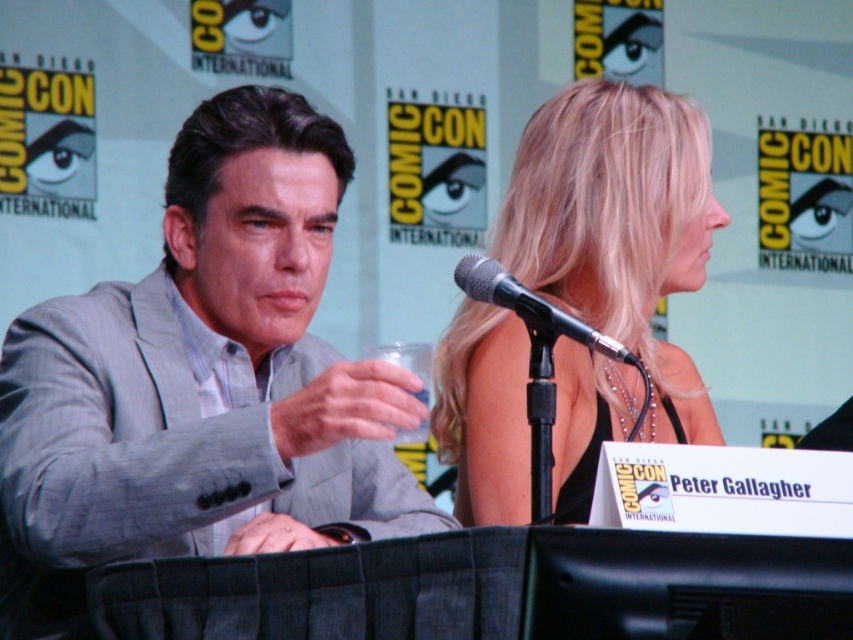
Question: Which of the following is the closest to the observer?

Choices:
 (A) gray pinstripe suit at left
 (B) blonde hair at center

Answer: (A)

Question: Is the position of blonde hair at center less distant than that of black metallic microphone at upper center?

Choices:
 (A) no
 (B) yes

Answer: (A)

Question: Is blonde hair at center below black metallic microphone at upper center?

Choices:
 (A) yes
 (B) no

Answer: (A)

Question: Which object appears closest to the camera in this image?

Choices:
 (A) blonde hair at center
 (B) black metallic microphone at upper center
 (C) gray pinstripe suit at left

Answer: (B)

Question: Estimate the real-world distances between objects in this image. Which object is farther from the black metallic microphone at upper center?

Choices:
 (A) gray pinstripe suit at left
 (B) blonde hair at center

Answer: (B)

Question: Is blonde hair at center above black metallic microphone at upper center?

Choices:
 (A) yes
 (B) no

Answer: (B)